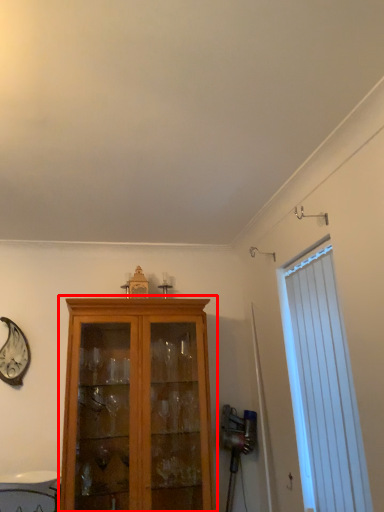
Question: In this image, where is cupboard (annotated by the red box) located relative to window?

Choices:
 (A) right
 (B) left

Answer: (B)